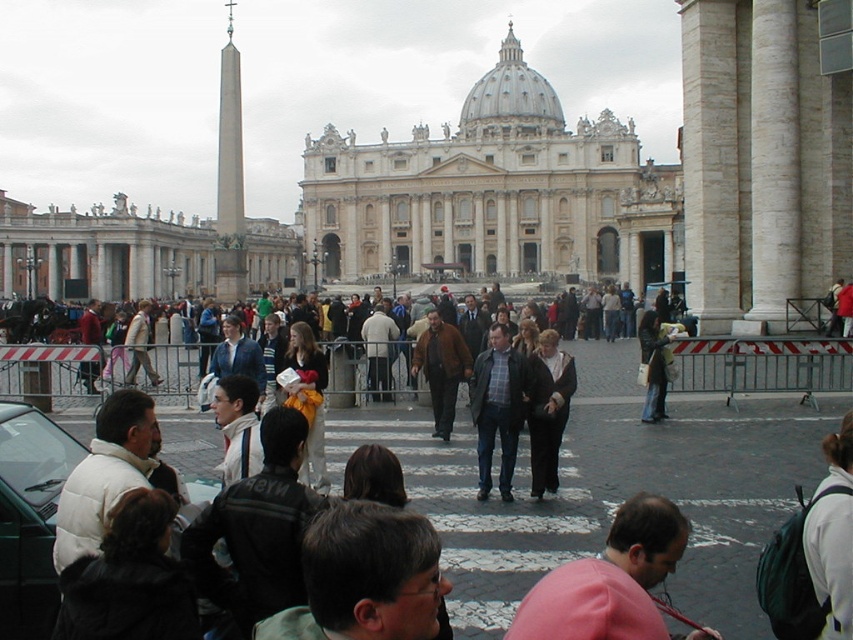
Question: Considering the real-world distances, which object is closest to the dark brown leather jacket at center?

Choices:
 (A) dark gray jacket at lower left
 (B) leather jacket at center
 (C) brown leather jacket at center

Answer: (C)

Question: From the image, what is the correct spatial relationship of black fabric coat at center in relation to light beige jacket at center?

Choices:
 (A) right
 (B) left

Answer: (A)

Question: Which object is the farthest from the black fabric coat at center?

Choices:
 (A) light beige jacket at center
 (B) dark brown leather jacket at center

Answer: (A)

Question: Does yellow fabric bag at center appear on the left side of brown leather jacket at center?

Choices:
 (A) yes
 (B) no

Answer: (A)

Question: Does dark brown jacket at lower left appear on the right side of black fabric coat at center?

Choices:
 (A) no
 (B) yes

Answer: (A)

Question: Which point appears closest to the camera in this image?

Choices:
 (A) (380, 470)
 (B) (138, 340)
 (C) (555, 426)
 (D) (312, 390)

Answer: (A)